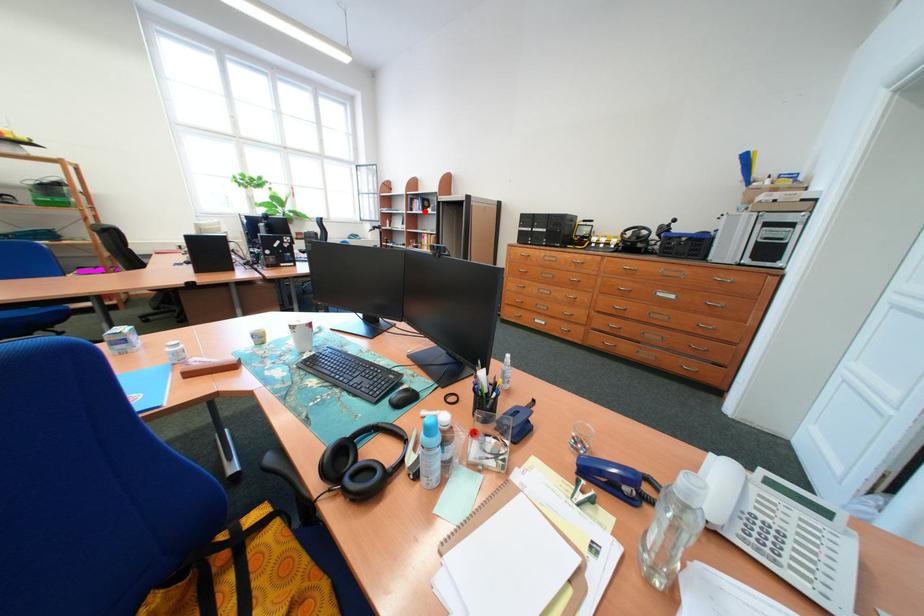
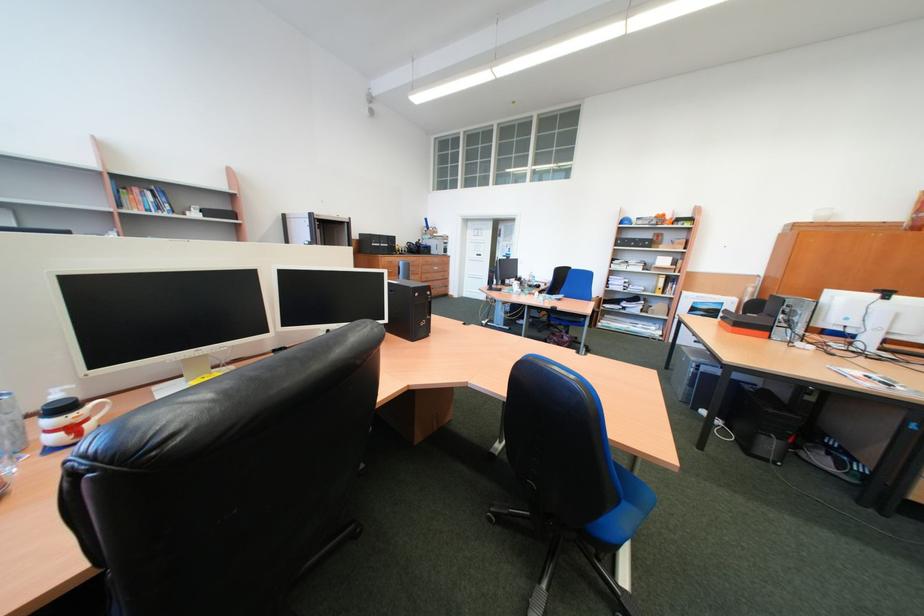
Question: I am providing you with two images of the same scene from different viewpoints. Given a red point in image1, look at the same physical point in image2. Is it:

Choices:
 (A) Closer to the viewpoint
 (B) Farther from the viewpoint

Answer: (B)